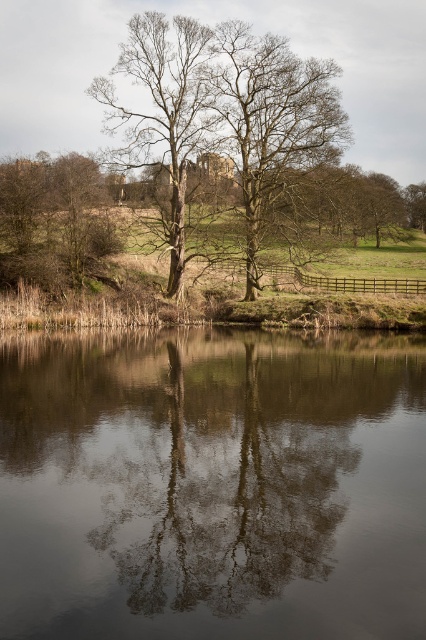
Question: Does bare wood tree at center appear over brown rough bark tree at left?

Choices:
 (A) yes
 (B) no

Answer: (A)

Question: Which point appears closest to the camera in this image?

Choices:
 (A) (265, 435)
 (B) (34, 260)

Answer: (A)

Question: Can you confirm if smooth reflective water at center is wider than brown rough bark tree at left?

Choices:
 (A) no
 (B) yes

Answer: (B)

Question: Does smooth brown tree at center appear under brown rough bark tree at left?

Choices:
 (A) yes
 (B) no

Answer: (B)

Question: Among these points, which one is nearest to the camera?

Choices:
 (A) (97, 536)
 (B) (189, 256)
 (C) (244, 33)

Answer: (A)

Question: Which point is closer to the camera?

Choices:
 (A) (83, 608)
 (B) (104, 214)
 (C) (198, 138)

Answer: (A)